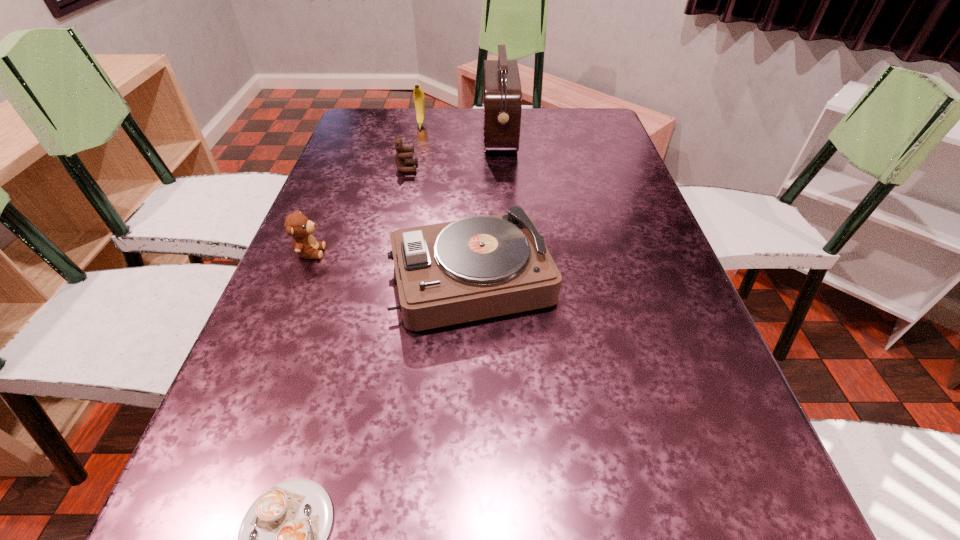
Find the location of a particular element. The image size is (960, 540). vacant position located from the stem of the banana is located at coordinates click(x=415, y=157).

Where is `free space located on the back of the record player`? free space located on the back of the record player is located at coordinates (472, 208).

Image resolution: width=960 pixels, height=540 pixels. In order to click on vacant area situated on the face of the left teddy bear in this screenshot , I will do `click(384, 252)`.

Locate an element on the screen. This screenshot has width=960, height=540. blank space located 0.200m on the face of the third farthest object is located at coordinates (490, 168).

This screenshot has height=540, width=960. What are the coordinates of `radio receiver located at the far edge` in the screenshot? It's located at (502, 87).

This screenshot has height=540, width=960. In order to click on banana present at the far edge in this screenshot , I will do `click(419, 99)`.

You are a GUI agent. You are given a task and a screenshot of the screen. Output one action in this format:
    pyautogui.click(x=<x>, y=<y>)
    Task: Click on the object present at the left edge
    The width and height of the screenshot is (960, 540).
    Given the screenshot: What is the action you would take?
    pyautogui.click(x=297, y=225)

At what (x,y) coordinates should I click in order to perform the action: click on vacant space at the far edge of the desktop. Please return your answer as a coordinate pair (x, y). Looking at the image, I should click on (413, 121).

The height and width of the screenshot is (540, 960). I want to click on vacant region at the left edge of the desktop, so click(309, 214).

In the image, there is a desktop. Where is `blank space at the right edge`? This screenshot has width=960, height=540. blank space at the right edge is located at coordinates (663, 429).